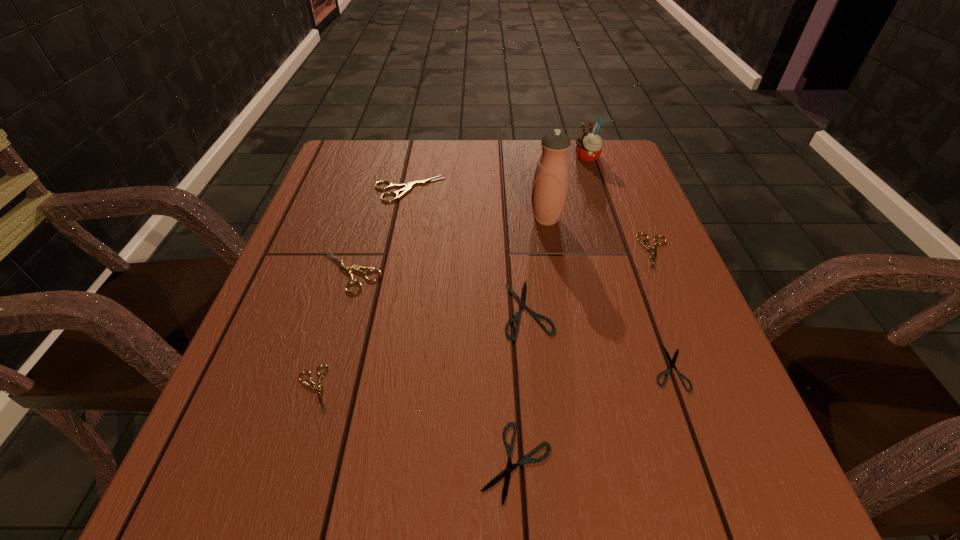
Locate an element on the screen. The image size is (960, 540). free point between the nearest beige shears and the second smallest beige shears is located at coordinates (486, 320).

Identify the location of vacant space that's between the sixth shortest object and the farthest black shears. (440, 291).

At what (x,y) coordinates should I click in order to perform the action: click on free space between the sixth shortest object and the farthest object. Please return your answer as a coordinate pair (x, y). The image size is (960, 540). Looking at the image, I should click on (468, 215).

Where is `vacant space that is in between the eighth nearest object and the rightmost shears`? vacant space that is in between the eighth nearest object and the rightmost shears is located at coordinates (533, 221).

Locate an element on the screen. free spot between the biggest beige shears and the farthest object is located at coordinates (498, 173).

Locate an element on the screen. Image resolution: width=960 pixels, height=540 pixels. unoccupied position between the smallest beige shears and the eighth shortest object is located at coordinates (451, 273).

Where is `blank region between the pink muffin and the farthest black shears`? blank region between the pink muffin and the farthest black shears is located at coordinates (558, 233).

Where is `empty space between the biggest black shears and the third tallest object`? Image resolution: width=960 pixels, height=540 pixels. empty space between the biggest black shears and the third tallest object is located at coordinates (468, 249).

The height and width of the screenshot is (540, 960). What are the coordinates of `free space between the tallest object and the sixth shortest shears` in the screenshot? It's located at (448, 246).

Identify the location of free point between the biggest black shears and the nearest beige shears. The height and width of the screenshot is (540, 960). 421,349.